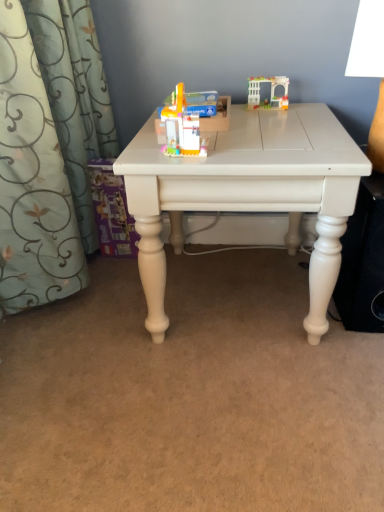
I want to click on free space in front of white matte speaker at lower right, so click(x=345, y=359).